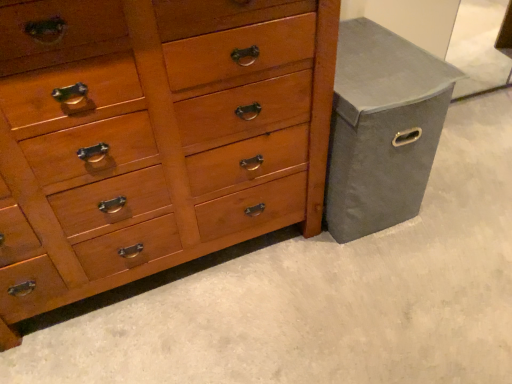
In order to click on free spot in front of matte gray fabric bin at right in this screenshot , I will do `click(379, 274)`.